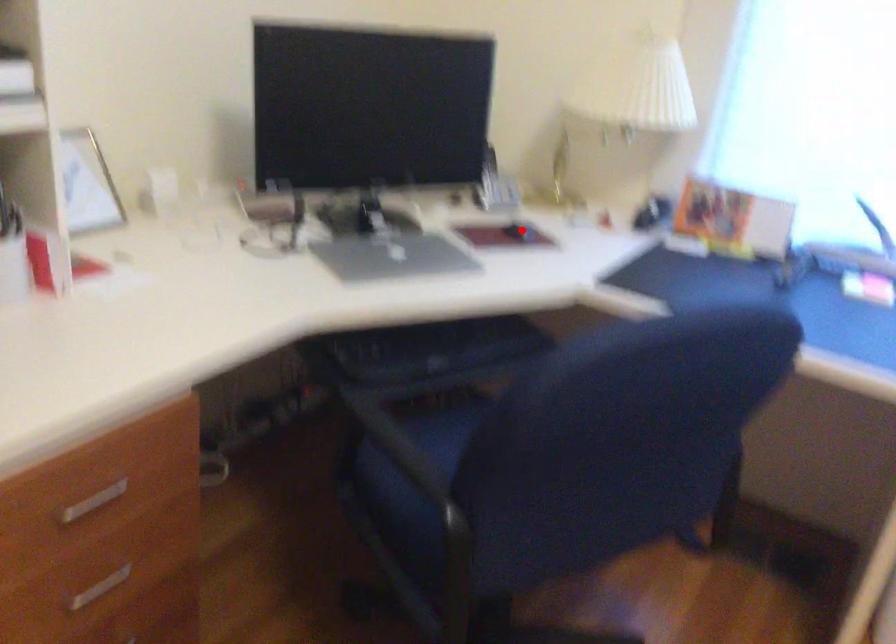
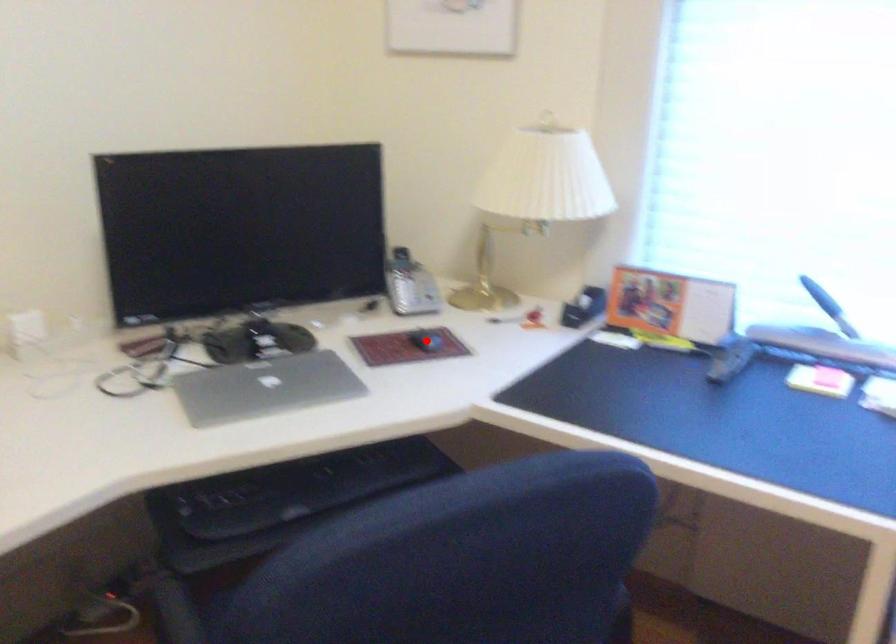
I am providing you with two images of the same scene from different viewpoints. A red point is marked on the first image and another point is marked on the second image. Is the marked point in image1 the same physical position as the marked point in image2?

Yes